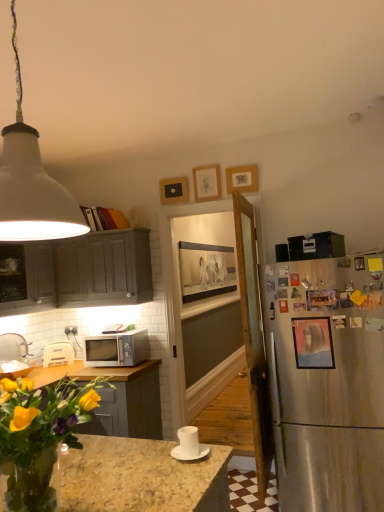
Question: Is white plastic toaster at lower left located outside matte gray cabinet at upper left, the 2th cabinetry viewed from the left?

Choices:
 (A) no
 (B) yes

Answer: (B)

Question: Could you tell me if white plastic toaster at lower left is facing matte gray cabinet at upper left, which is the first cabinetry from right to left?

Choices:
 (A) no
 (B) yes

Answer: (A)

Question: Is the position of white plastic toaster at lower left less distant than that of matte gray cabinet at upper left, the 2th cabinetry viewed from the left?

Choices:
 (A) no
 (B) yes

Answer: (A)

Question: Can you confirm if white plastic toaster at lower left is bigger than matte gray cabinet at upper left, the 2th cabinetry viewed from the left?

Choices:
 (A) yes
 (B) no

Answer: (B)

Question: From the image's perspective, is white plastic toaster at lower left under matte gray cabinet at upper left, which is the first cabinetry from right to left?

Choices:
 (A) yes
 (B) no

Answer: (A)

Question: Is white plastic toaster at lower left to the right of matte gray cabinet at upper left, which is the first cabinetry from right to left, from the viewer's perspective?

Choices:
 (A) yes
 (B) no

Answer: (B)

Question: Is white matte pendant light at upper left facing away from satin silver microwave at lower left?

Choices:
 (A) no
 (B) yes

Answer: (A)

Question: Is white matte pendant light at upper left taller than satin silver microwave at lower left?

Choices:
 (A) yes
 (B) no

Answer: (A)

Question: Can you confirm if white matte pendant light at upper left is wider than satin silver microwave at lower left?

Choices:
 (A) yes
 (B) no

Answer: (A)

Question: Is white matte pendant light at upper left bigger than satin silver microwave at lower left?

Choices:
 (A) yes
 (B) no

Answer: (A)

Question: Considering the relative positions of white matte pendant light at upper left and satin silver microwave at lower left in the image provided, is white matte pendant light at upper left to the right of satin silver microwave at lower left from the viewer's perspective?

Choices:
 (A) no
 (B) yes

Answer: (B)

Question: Considering the relative sizes of white matte pendant light at upper left and satin silver microwave at lower left in the image provided, is white matte pendant light at upper left thinner than satin silver microwave at lower left?

Choices:
 (A) yes
 (B) no

Answer: (B)

Question: Considering the relative positions of matte pink picture frame at right, marked as the 2th picture frame in a front-to-back arrangement, and white plastic toaster at lower left in the image provided, is matte pink picture frame at right, marked as the 2th picture frame in a front-to-back arrangement, to the right of white plastic toaster at lower left from the viewer's perspective?

Choices:
 (A) yes
 (B) no

Answer: (A)